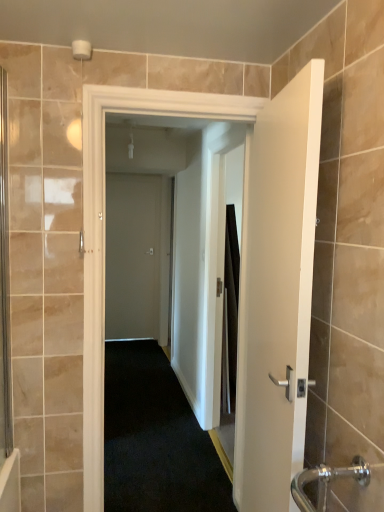
Question: From the image's perspective, is matte gray door at center, the 3th door positioned from the right, under white matte door at center, which is the second door from back to front?

Choices:
 (A) no
 (B) yes

Answer: (A)

Question: Is white matte door at center, which is counted as the second door, starting from the right, surrounded by matte gray door at center, the 3th door positioned from the right?

Choices:
 (A) yes
 (B) no

Answer: (B)

Question: Is matte gray door at center, the 3th door positioned from the right, thinner than white matte door at center, which appears as the 2th door when viewed from the front?

Choices:
 (A) yes
 (B) no

Answer: (A)

Question: Is matte gray door at center, which is the first door in back-to-front order, positioned behind white matte door at center, which is the second door in left-to-right order?

Choices:
 (A) no
 (B) yes

Answer: (B)

Question: Does matte gray door at center, the 3th door from the front, have a greater height compared to white matte door at center, which is counted as the second door, starting from the right?

Choices:
 (A) no
 (B) yes

Answer: (A)

Question: Is matte gray door at center, which is the first door in back-to-front order, positioned in front of white matte door at center, which is the second door in left-to-right order?

Choices:
 (A) no
 (B) yes

Answer: (A)

Question: Is white matte door at center, the first door from the right, bigger than white matte door at center, which is the second door from back to front?

Choices:
 (A) no
 (B) yes

Answer: (B)

Question: Is white matte door at center, arranged as the 1th door when viewed from the front, not inside white matte door at center, which appears as the 2th door when viewed from the front?

Choices:
 (A) no
 (B) yes

Answer: (B)

Question: Does white matte door at center, arranged as the 1th door when viewed from the front, have a lesser height compared to white matte door at center, which appears as the 2th door when viewed from the front?

Choices:
 (A) yes
 (B) no

Answer: (A)

Question: From the image's perspective, is white matte door at center, the third door from the back, on top of white matte door at center, which is the second door from back to front?

Choices:
 (A) yes
 (B) no

Answer: (B)

Question: Is white matte door at center, the first door from the right, in front of white matte door at center, which is the second door from back to front?

Choices:
 (A) no
 (B) yes

Answer: (B)

Question: Is white matte door at center, the third door from the back, surrounding white matte door at center, which appears as the 2th door when viewed from the front?

Choices:
 (A) no
 (B) yes

Answer: (A)

Question: Can you confirm if white matte door at center, the third door from the back, is taller than matte gray door at center, the 3th door positioned from the right?

Choices:
 (A) no
 (B) yes

Answer: (A)